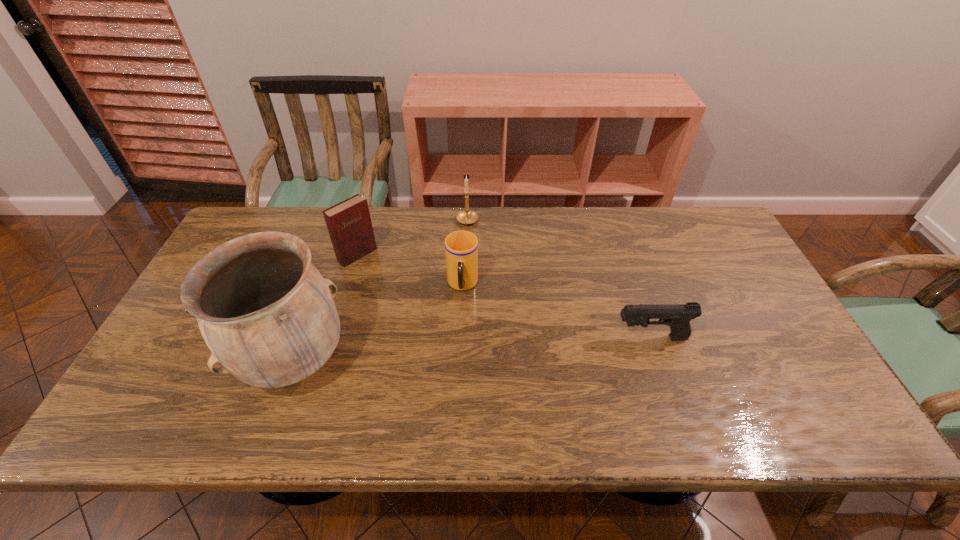
Find the location of a particular element. The height and width of the screenshot is (540, 960). vacant region located 0.310m on the handle side of the farthest object is located at coordinates (454, 301).

Where is `vacant space situated 0.090m on the handle side of the farthest object`? The image size is (960, 540). vacant space situated 0.090m on the handle side of the farthest object is located at coordinates (463, 249).

The width and height of the screenshot is (960, 540). What are the coordinates of `free space located 0.360m on the front cover of the diary` in the screenshot? It's located at (448, 330).

Where is `vacant area situated on the front cover of the diary`? vacant area situated on the front cover of the diary is located at coordinates (384, 277).

The width and height of the screenshot is (960, 540). I want to click on vacant space situated 0.070m on the front cover of the diary, so pos(382,275).

Locate an element on the screen. The height and width of the screenshot is (540, 960). vacant space located 0.150m on the side of the third nearest object with the handle is located at coordinates (458, 346).

You are a GUI agent. You are given a task and a screenshot of the screen. Output one action in this format:
    pyautogui.click(x=<x>, y=<y>)
    Task: Click on the vacant space located 0.150m on the side of the third nearest object with the handle
    
    Given the screenshot: What is the action you would take?
    click(x=458, y=346)

This screenshot has height=540, width=960. Find the location of `blank area located 0.080m on the side of the third nearest object with the handle`. blank area located 0.080m on the side of the third nearest object with the handle is located at coordinates (460, 324).

At what (x,y) coordinates should I click in order to perform the action: click on candle holder situated at the far edge. Please return your answer as a coordinate pair (x, y). The image size is (960, 540). Looking at the image, I should click on (467, 216).

At what (x,y) coordinates should I click in order to perform the action: click on diary that is at the far edge. Please return your answer as a coordinate pair (x, y). Looking at the image, I should click on (349, 224).